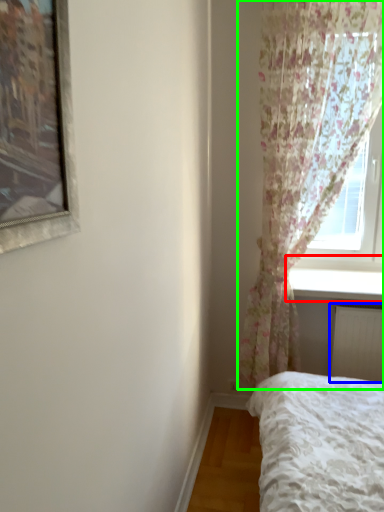
Question: Considering the real-world distances, which object is closest to window sill (highlighted by a red box)? radiator (highlighted by a blue box) or curtain (highlighted by a green box).

Choices:
 (A) radiator
 (B) curtain

Answer: (A)